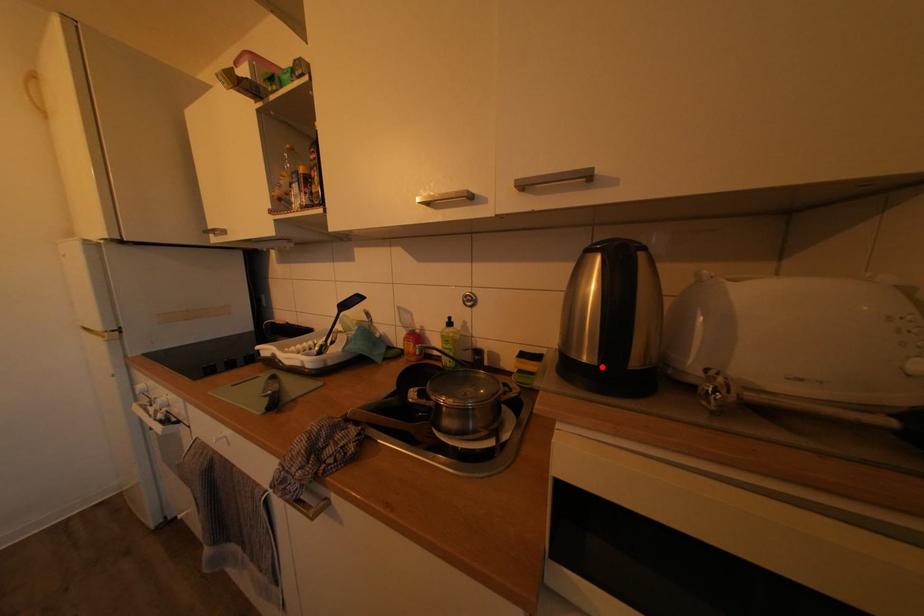
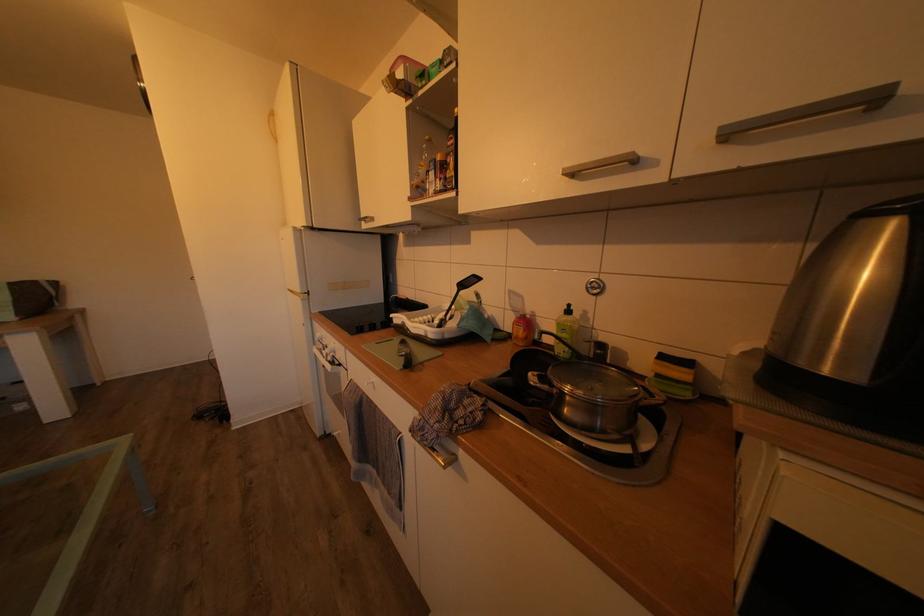
Question: I am providing you with two images of the same scene from different viewpoints. A red point is marked on the first image. Is the red point's position out of view in image 2?

Choices:
 (A) Yes
 (B) No

Answer: (B)